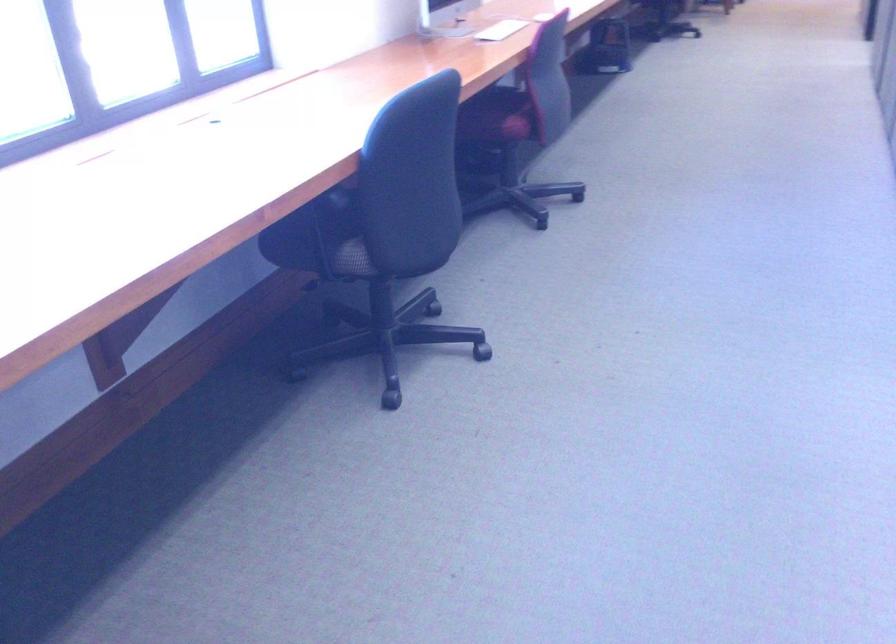
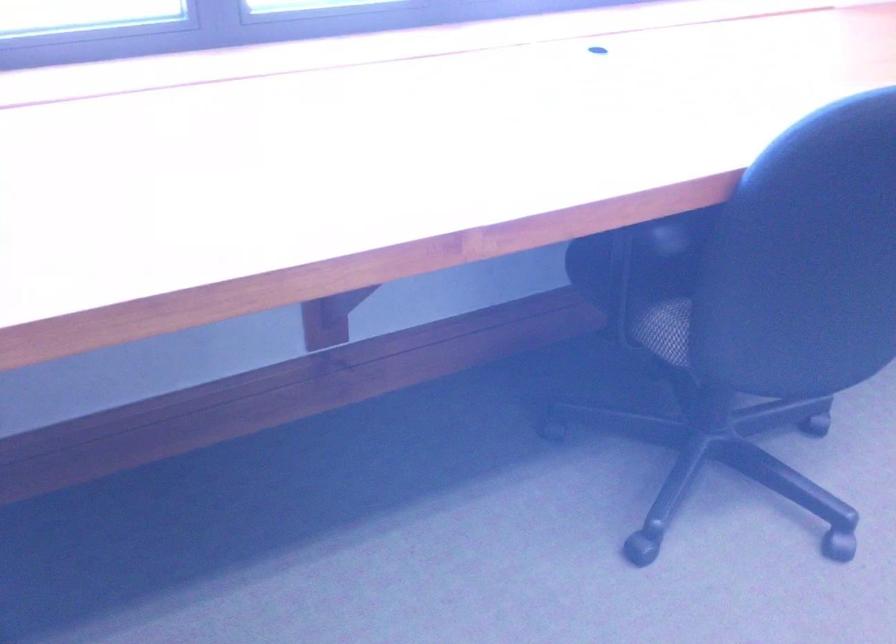
Where in the second image is the point corresponding to pixel 325 238 from the first image?

(645, 279)